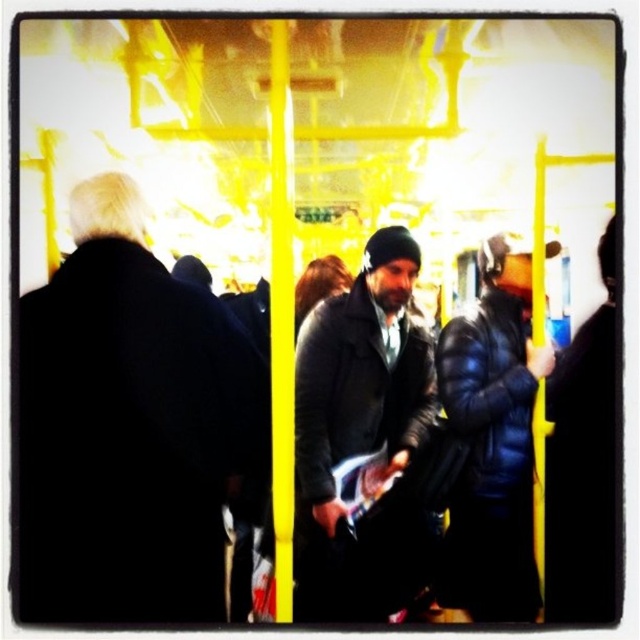
You are a passenger on a subway train and you see the black matte coat at left. If you want to reach into your bag that is 1 meter away from you, will your arm be able to reach the bag without moving your body?

The black matte coat at left is 1.51 meters away from you, so your arm can comfortably reach the bag that is 1 meter away without needing to move your body.

From the picture: You are a photographer trying to capture a clear shot of both the dark gray leather jacket at center and the dark blue puffy jacket at center in the subway scene. If you want to ensure both jackets are fully visible in your frame, which jacket should you adjust your focus on first based on their sizes?

The dark gray leather jacket at center is wider than the dark blue puffy jacket at center. Therefore, you should focus on the dark gray leather jacket at center first to ensure it fits within the frame, as its larger size may require more space.